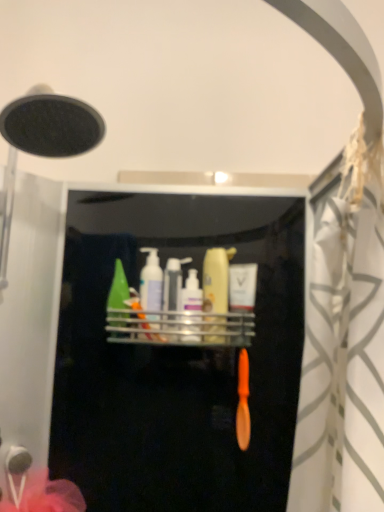
You are a GUI agent. You are given a task and a screenshot of the screen. Output one action in this format:
    pyautogui.click(x=<x>, y=<y>)
    Task: Click on the vacant space situated above metallic silver shelf at center (from a real-world perspective)
    The height and width of the screenshot is (512, 384).
    Given the screenshot: What is the action you would take?
    pyautogui.click(x=180, y=306)